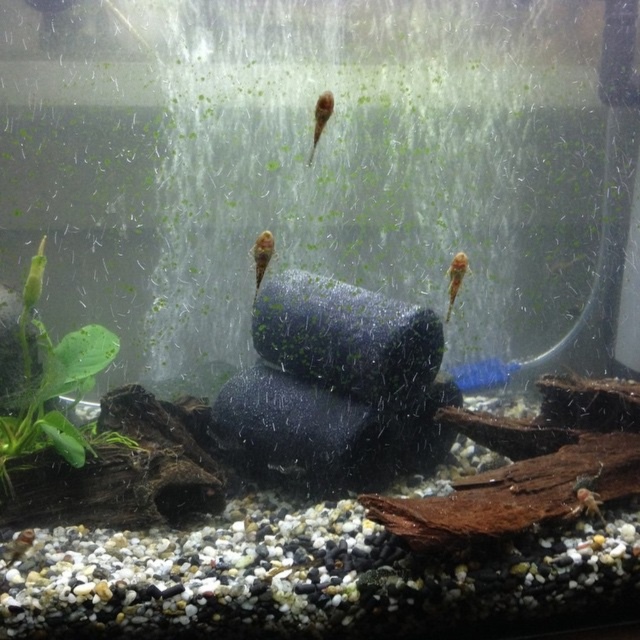
You are an aquatic plant enthusiast observing the aquarium. You notice the green leafy plant at left and want to place a new decoration near it. Based on its current position, can you determine if the decoration will fit in the remaining space to the right of the plant?

The green leafy plant at left is located at point (51, 381). Since the coordinates indicate its position on the left side of the tank, there is sufficient space to the right for placing the new decoration without overcrowding the aquarium.

Based on the photo, what is located at the coordinates point (260, 253) in the aquarium?

The point (260, 253) corresponds to a translucent yellowish fish at center.

You are an observer looking into the aquarium. You notice the green leafy plant at left and the translucent orange fish at center. Which object is located lower in the tank?

The green leafy plant at left is positioned under the translucent orange fish at center, so it is located lower in the tank.